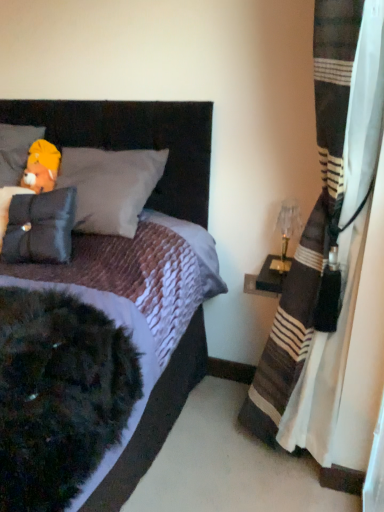
Question: Does soft yellow plush at upper left, the 2th pillow when ordered from bottom to top, appear on the right side of fluffy yellow bear at upper left?

Choices:
 (A) yes
 (B) no

Answer: (B)

Question: Is soft yellow plush at upper left, the 2th pillow when ordered from bottom to top, touching fluffy yellow bear at upper left?

Choices:
 (A) no
 (B) yes

Answer: (B)

Question: From the image's perspective, is soft yellow plush at upper left, the first pillow viewed from the top, below fluffy yellow bear at upper left?

Choices:
 (A) no
 (B) yes

Answer: (A)

Question: Is soft yellow plush at upper left, the 2th pillow when ordered from bottom to top, positioned behind fluffy yellow bear at upper left?

Choices:
 (A) yes
 (B) no

Answer: (B)

Question: Is soft yellow plush at upper left, the 2th pillow when ordered from bottom to top, wider than fluffy yellow bear at upper left?

Choices:
 (A) no
 (B) yes

Answer: (B)

Question: Would you say soft yellow plush at upper left, the first pillow viewed from the top, is outside fluffy yellow bear at upper left?

Choices:
 (A) yes
 (B) no

Answer: (A)

Question: From the image's perspective, would you say striped fabric curtain at right is shown under translucent glass table lamp at right?

Choices:
 (A) no
 (B) yes

Answer: (B)

Question: Is striped fabric curtain at right taller than translucent glass table lamp at right?

Choices:
 (A) no
 (B) yes

Answer: (B)

Question: Is the depth of striped fabric curtain at right less than that of translucent glass table lamp at right?

Choices:
 (A) yes
 (B) no

Answer: (A)

Question: Can you confirm if striped fabric curtain at right is positioned to the right of translucent glass table lamp at right?

Choices:
 (A) yes
 (B) no

Answer: (B)

Question: Can you confirm if striped fabric curtain at right is wider than translucent glass table lamp at right?

Choices:
 (A) yes
 (B) no

Answer: (A)

Question: Does striped fabric curtain at right lie behind translucent glass table lamp at right?

Choices:
 (A) no
 (B) yes

Answer: (A)

Question: Does matte black headboard at upper left appear on the left side of translucent glass table lamp at right?

Choices:
 (A) yes
 (B) no

Answer: (A)